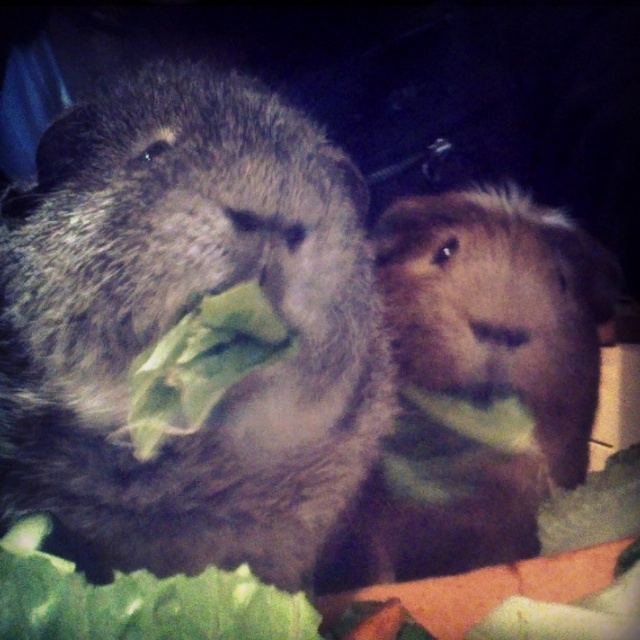
Who is more forward, (x=204, y=221) or (x=148, y=406)?

Point (x=204, y=221)

Is point (132, 268) less distant than point (244, 339)?

Yes, point (132, 268) is in front of point (244, 339).

Find the location of `fuzzy gray guinea pig at left`. fuzzy gray guinea pig at left is located at coordinates (179, 317).

Which of these two, fuzzy brown guinea pig at center or green leafy vegetable at center, stands taller?

With more height is fuzzy brown guinea pig at center.

Does fuzzy brown guinea pig at center have a smaller size compared to green leafy vegetable at center?

Incorrect, fuzzy brown guinea pig at center is not smaller in size than green leafy vegetable at center.

What do you see at coordinates (477, 381) in the screenshot?
I see `fuzzy brown guinea pig at center` at bounding box center [477, 381].

Where is `fuzzy brown guinea pig at center`? This screenshot has height=640, width=640. fuzzy brown guinea pig at center is located at coordinates (477, 381).

Between fuzzy gray guinea pig at left and fuzzy brown guinea pig at center, which one is positioned lower?

fuzzy brown guinea pig at center is lower down.

Can you confirm if fuzzy gray guinea pig at left is smaller than fuzzy brown guinea pig at center?

Yes.

Locate an element on the screen. The image size is (640, 640). fuzzy gray guinea pig at left is located at coordinates (179, 317).